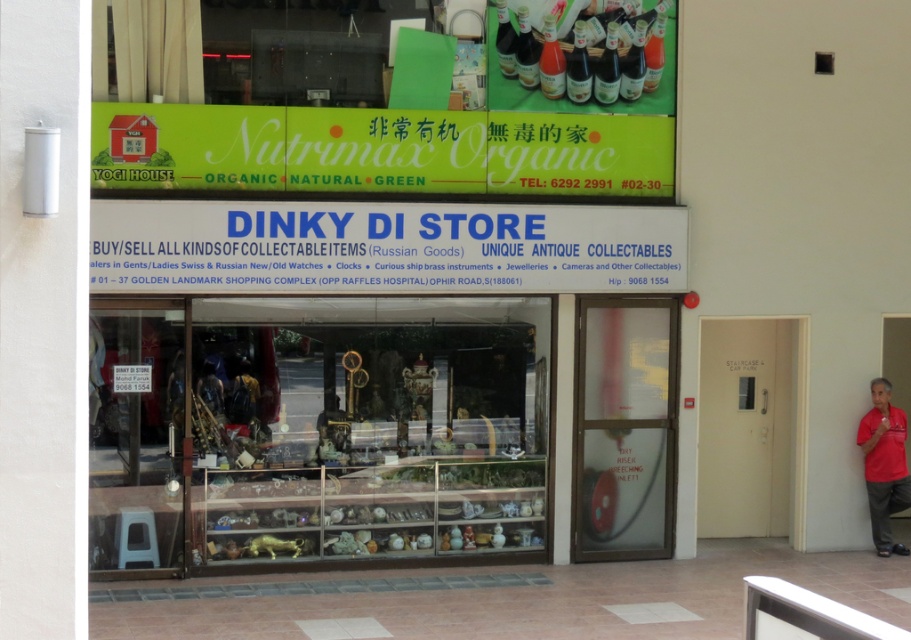
Question: Can you confirm if frosted glass door at center is positioned below red shirt at right?

Choices:
 (A) yes
 (B) no

Answer: (B)

Question: Does white plastic signboard at center come behind white matte door at right?

Choices:
 (A) yes
 (B) no

Answer: (B)

Question: Which object is the closest to the white plastic signboard at center?

Choices:
 (A) red shirt at right
 (B) translucent glass bottle at upper center
 (C) translucent plastic bottle at upper center

Answer: (C)

Question: Which point is farther from the camera taking this photo?

Choices:
 (A) (586, 355)
 (B) (550, 19)
 (C) (590, 291)
 (D) (507, 35)

Answer: (A)

Question: Is white plastic signboard at center to the left of white matte door at right from the viewer's perspective?

Choices:
 (A) no
 (B) yes

Answer: (B)

Question: Which point is closer to the camera?

Choices:
 (A) translucent glass bottle at upper center
 (B) red shirt at right
 (C) translucent plastic bottle at upper center

Answer: (A)